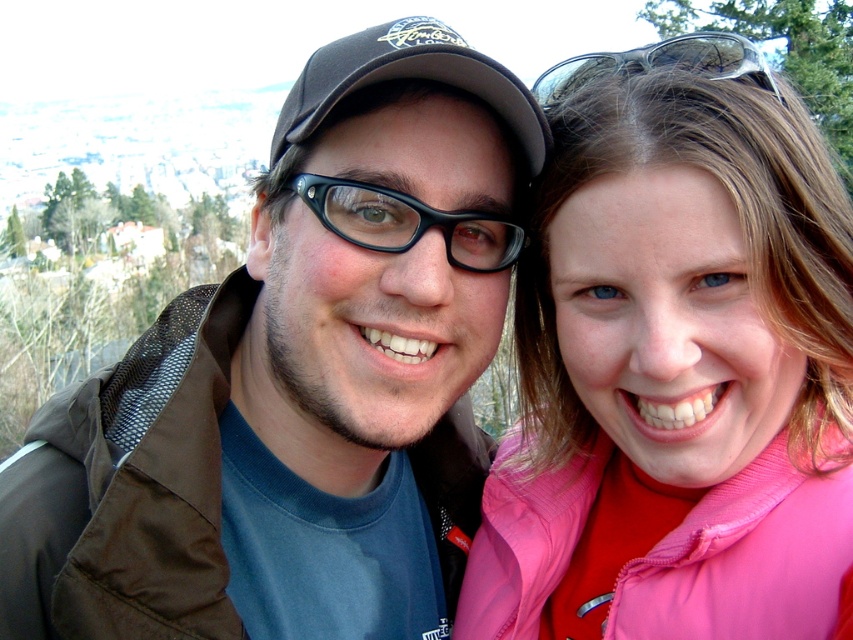
You are a photographer setting up a shot for two people. You have a matte black jacket at center and a clear plastic goggles at upper right in your frame. Which object takes up more horizontal space in the image?

The clear plastic goggles at upper right takes up more horizontal space in the image because the matte black jacket at center has a lesser width compared to clear plastic goggles at upper right.

You are a photographer trying to adjust the lighting for a photo shoot. You notice the matte black jacket at center and the clear plastic goggles at upper right. Which object is located more to the left in the frame?

The matte black jacket at center is positioned on the left side of the clear plastic goggles at upper right, so it is more to the left in the frame.

You are a photographer trying to capture a closeup of both the pink fabric jacket at upper right and the clear plastic goggles at upper right in the scene. Given their distance apart, will you need to adjust your camera settings to focus on both objects simultaneously?

The pink fabric jacket at upper right is 24.50 meters from the clear plastic goggles at upper right. To focus on both objects simultaneously, you would need to adjust your camera settings to ensure a sufficient depth of field, as the distance between them is quite large.